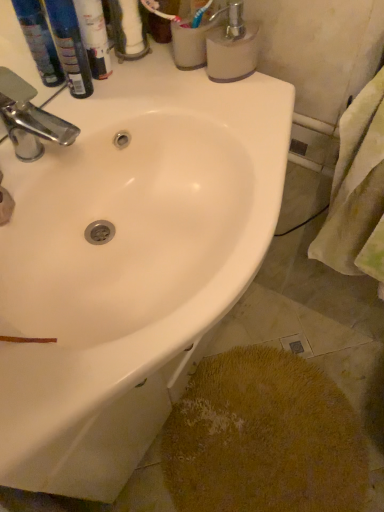
Find the location of a particular element. free space above yellow textured rug at lower right (from a real-world perspective) is located at coordinates (245, 441).